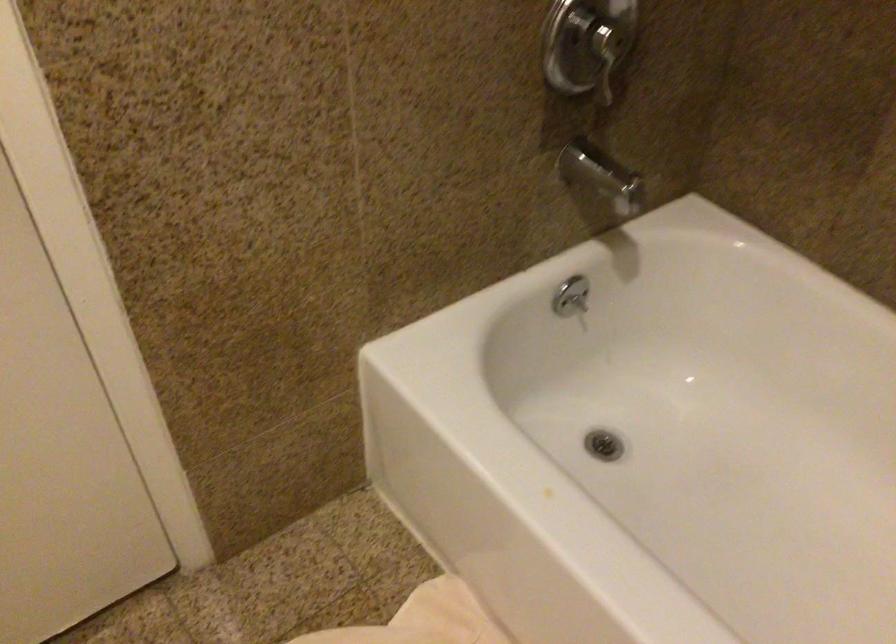
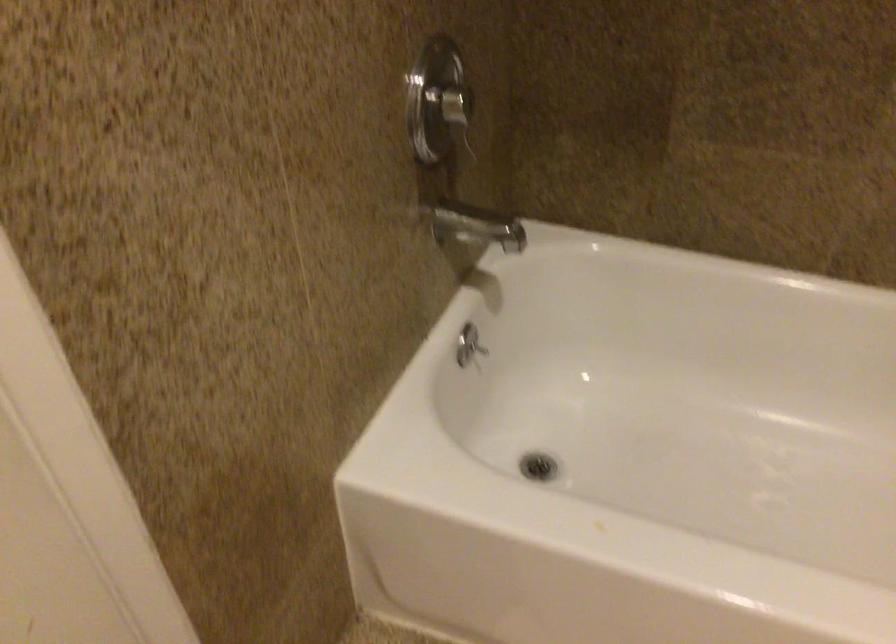
Locate, in the second image, the point that corresponds to pixel 633 90 in the first image.

(467, 140)